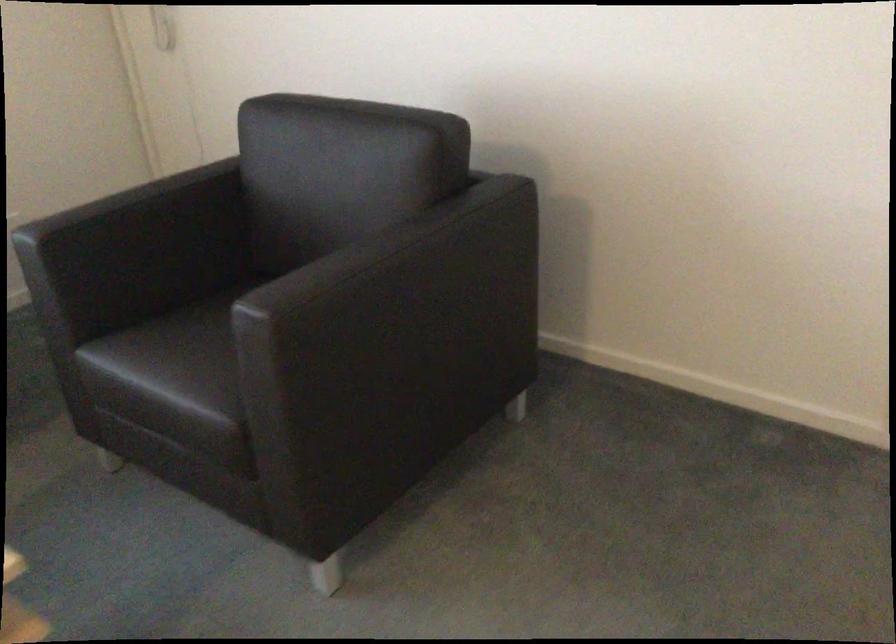
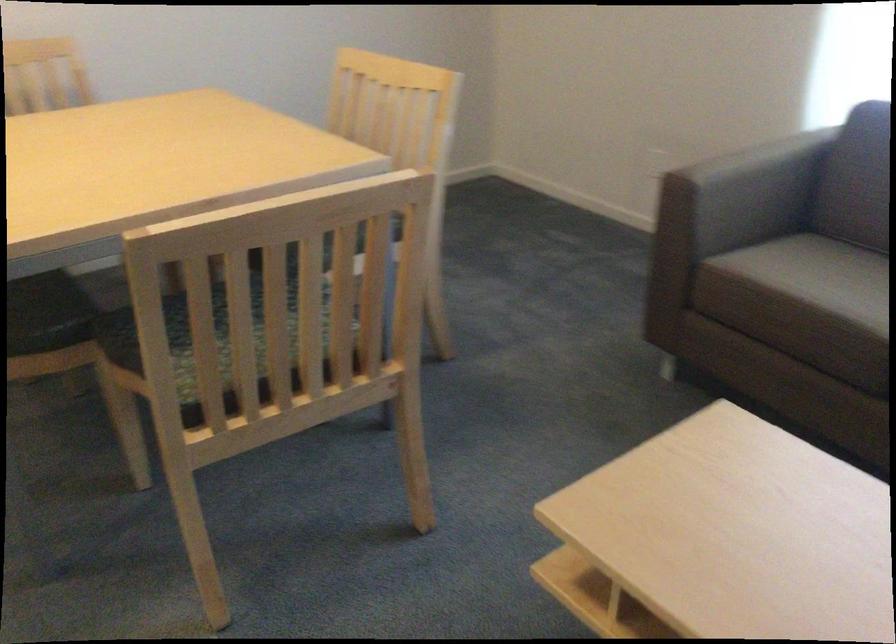
The first image is from the beginning of the video and the second image is from the end. How did the camera likely rotate when shooting the video?

The camera rotated toward left-down.